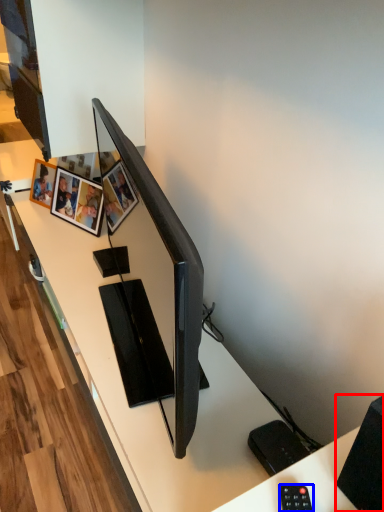
Question: Which object appears closest to the camera in this image, speaker (highlighted by a red box) or control (highlighted by a blue box)?

Choices:
 (A) speaker
 (B) control

Answer: (A)